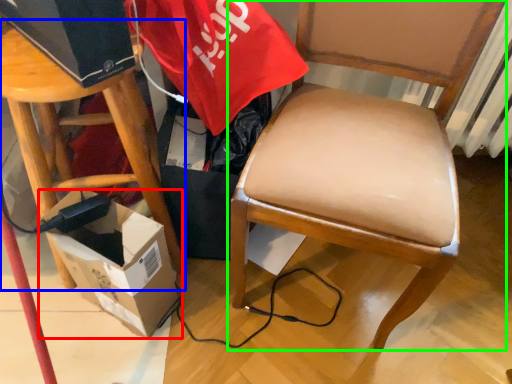
Question: Based on their relative distances, which object is nearer to box (highlighted by a red box)? Choose from stool (highlighted by a blue box) and chair (highlighted by a green box).

Choices:
 (A) stool
 (B) chair

Answer: (A)